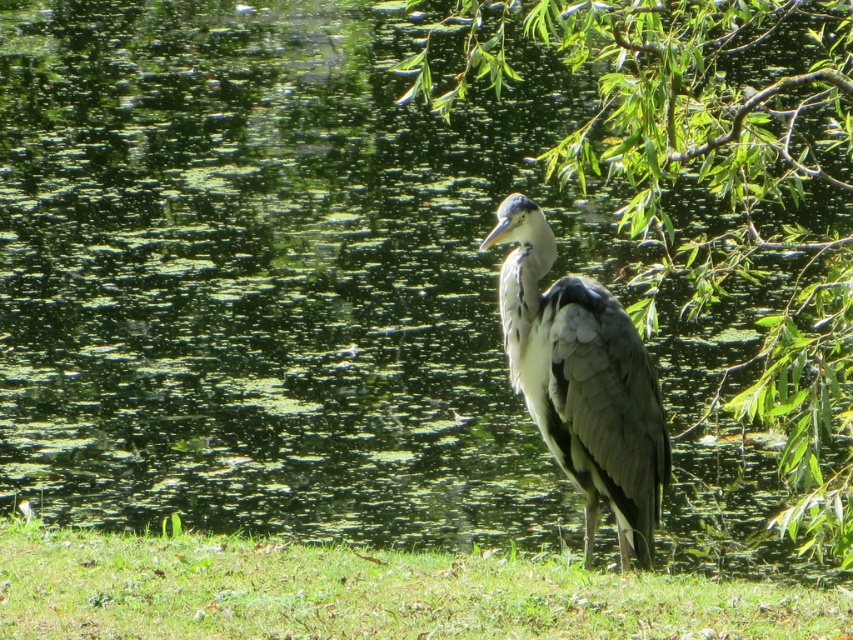
You are a small animal that needs to cross from the green leafy tree at center to the green grass at lower center. The distance between them is 9.18 feet. If your maximum jumping distance is 5 feet, can you safely make the jump?

The green leafy tree at center is 9.18 feet away from the green grass at lower center. Since your maximum jumping distance is 5 feet, you cannot safely make the jump as the required distance exceeds your capability.

You are a photographer trying to capture the gray feathered heron at center and the green leafy tree at center in a single shot. Based on their sizes, which one would appear larger in the photo?

The green leafy tree at center would appear larger in the photo because it is bigger than the gray feathered heron at center according to the description.

You are a photographer trying to capture the gray feathered heron at center and the green leafy tree at center in the same frame. Which object should you focus on first to ensure both are in focus?

The green leafy tree at center is closer to the viewer than the gray feathered heron at center, so you should focus on the green leafy tree at center first to ensure both are in focus.